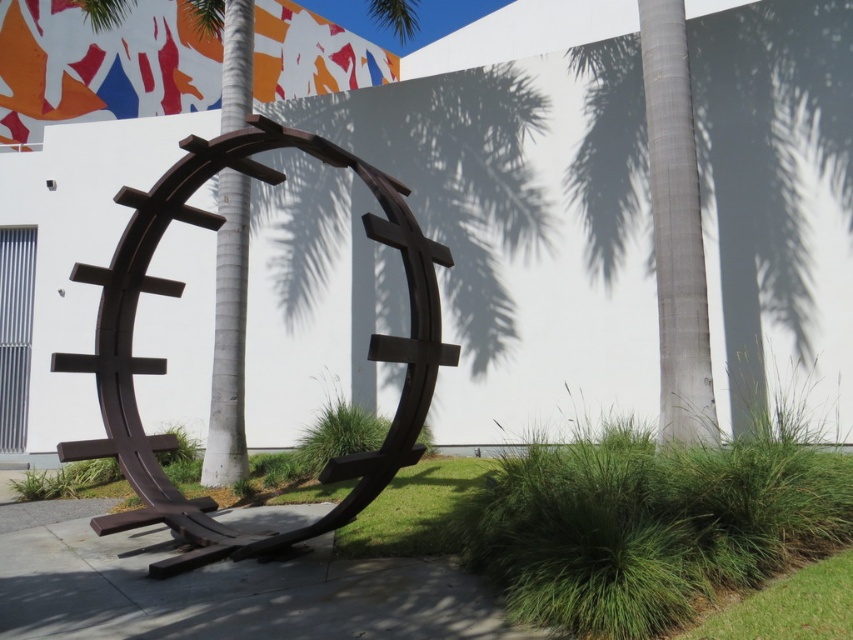
Who is shorter, smooth gray palm tree at right or brown metal sculpture at center?

With less height is smooth gray palm tree at right.

Is smooth gray palm tree at right shorter than brown metal sculpture at center?

Yes, smooth gray palm tree at right is shorter than brown metal sculpture at center.

You are a GUI agent. You are given a task and a screenshot of the screen. Output one action in this format:
    pyautogui.click(x=<x>, y=<y>)
    Task: Click on the smooth gray palm tree at right
    The height and width of the screenshot is (640, 853).
    Given the screenshot: What is the action you would take?
    pyautogui.click(x=704, y=182)

Image resolution: width=853 pixels, height=640 pixels. In order to click on smooth gray palm tree at right in this screenshot , I will do `click(704, 182)`.